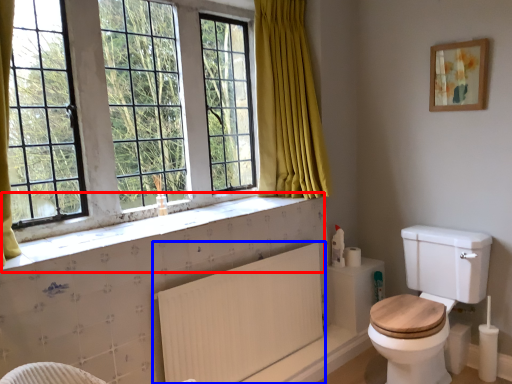
Question: Which object appears closest to the camera in this image, window sill (highlighted by a red box) or radiator (highlighted by a blue box)?

Choices:
 (A) window sill
 (B) radiator

Answer: (A)